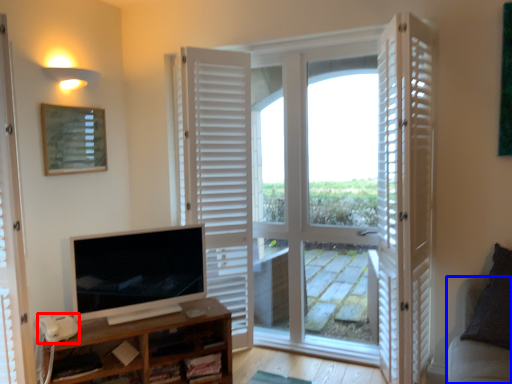
Question: Which object is further to the camera taking this photo, corded phone (highlighted by a red box) or couch (highlighted by a blue box)?

Choices:
 (A) corded phone
 (B) couch

Answer: (A)